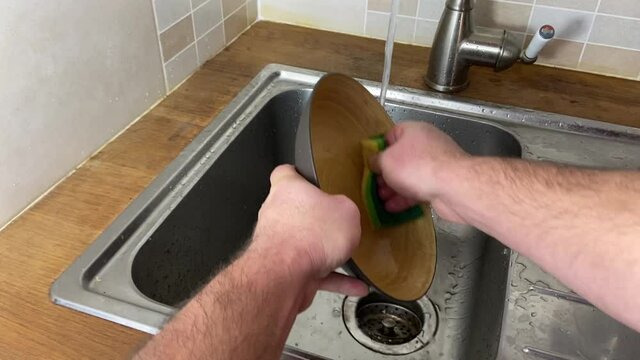
Find the location of `tap handle`. tap handle is located at coordinates (536, 36).